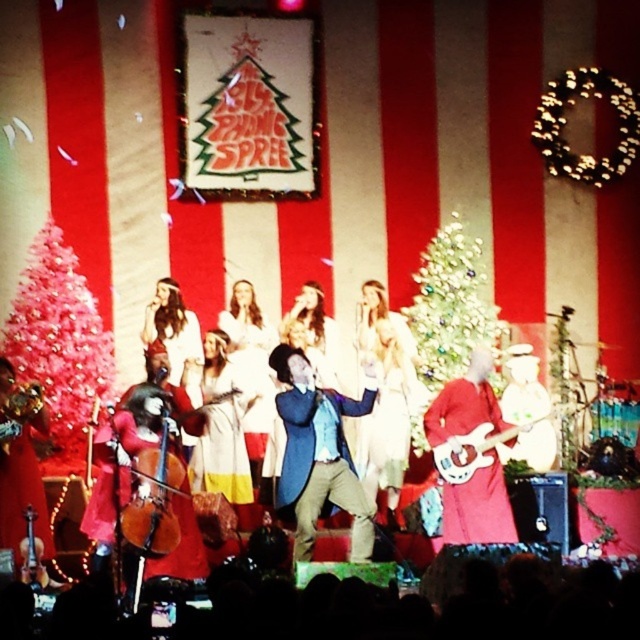
You are an audience member sitting in the front row of the Elvis Christmas Spree performance. You notice the green glittery christmas tree at center and the brown wooden cello at lower left. Which object is positioned to the right of the other?

Answer: The green glittery christmas tree at center is positioned to the right of the brown wooden cello at lower left.

From the picture: You are a stagehand setting up for the show. You need to move the brown wooden cello at lower left closer to the green glittery christmas tree at center. Will the cello fit next to the tree without overlapping it?

The green glittery christmas tree at center is larger than the brown wooden cello at lower left. Since the cello is smaller, it can be placed next to the tree without overlapping.

You are a stagehand who needs to move the brown wooden cello at lower left closer to the white fabric dress at center. The stage has a clear path between them. If you move the cello 10 feet towards the dress, how far apart will they be?

The initial distance between the brown wooden cello at lower left and the white fabric dress at center is 33.83 feet. After moving the cello 10 feet closer, the remaining distance would be 23.83 feet.